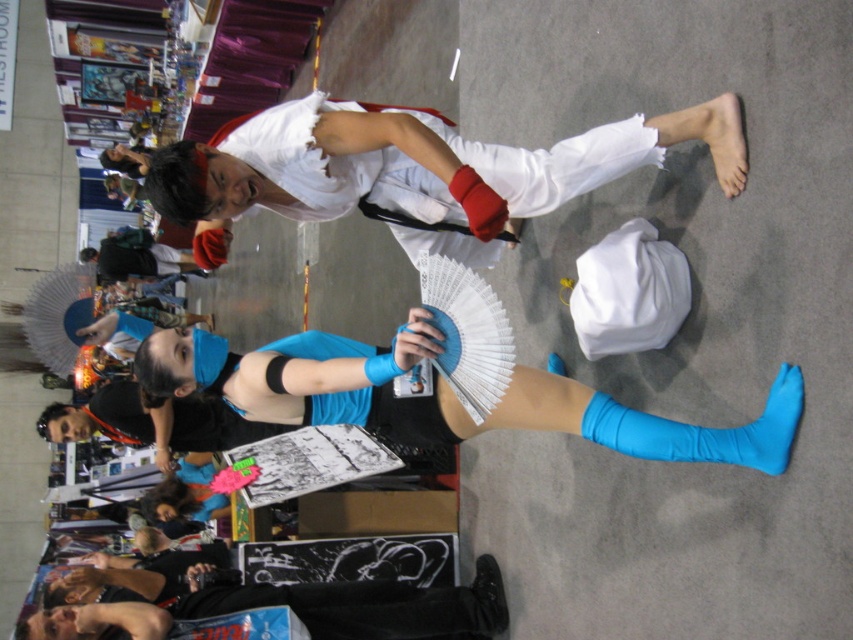
You are at a cosplay event and need to find the black leather jacket at lower left. Can you tell me if it is positioned above or below the blue stretchy sock at lower right?

The black leather jacket at lower left is located below the blue stretchy sock at lower right.

You are a photographer at the event and need to capture a photo that includes both the black leather jacket at lower left and the blue stretchy sock at lower right. The camera you are using has a maximum focus range of 4 feet. Can you fit both objects in the frame without moving the camera?

The black leather jacket at lower left and blue stretchy sock at lower right are 4.52 feet apart from each other. Since the maximum focus range is 4 feet, the distance between them exceeds the camera capability. Therefore, you cannot fit both objects in the frame without moving the camera.

You are at the convention and want to take a photo of both the point at (x=213, y=608) and the point at (x=799, y=406). Which point should you focus on first to ensure both are in the frame?

You should focus on point (x=799, y=406) first because point (x=213, y=608) is behind it, so adjusting the camera to include both would require starting with the front point.